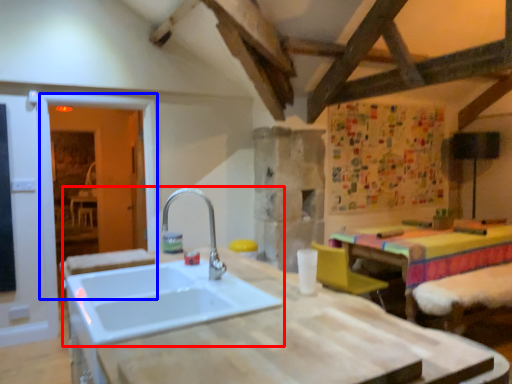
Question: Which of the following is the closest to the observer, sink (highlighted by a red box) or glass door (highlighted by a blue box)?

Choices:
 (A) sink
 (B) glass door

Answer: (A)